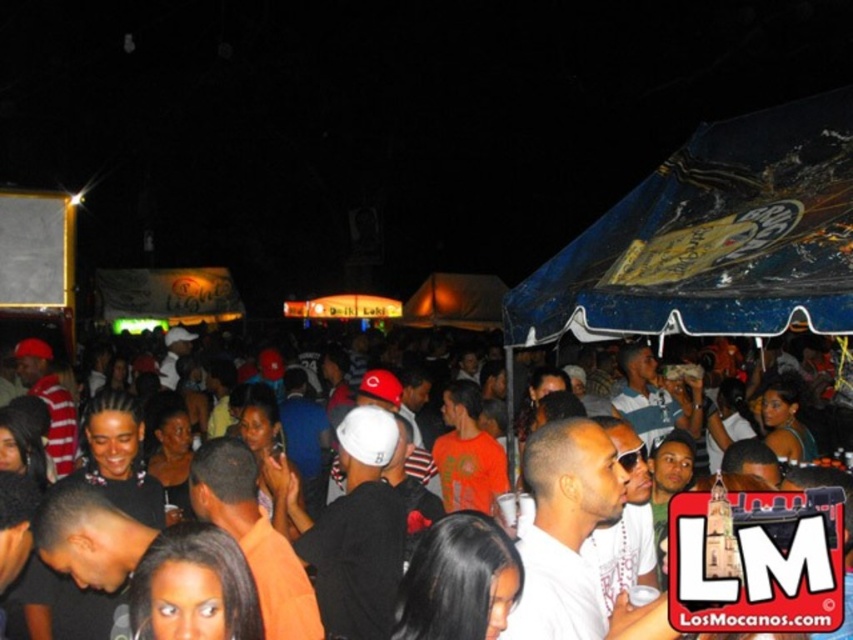
Question: Which point is closer to the camera taking this photo?

Choices:
 (A) (781, 122)
 (B) (38, 630)

Answer: (B)

Question: Which of the following is the closest to the observer?

Choices:
 (A) black matte crowd at center
 (B) blue plastic canopy at upper right

Answer: (A)

Question: Can you confirm if blue plastic canopy at upper right is thinner than black matte crowd at center?

Choices:
 (A) yes
 (B) no

Answer: (A)

Question: Is blue plastic canopy at upper right positioned at the back of black matte crowd at center?

Choices:
 (A) no
 (B) yes

Answer: (B)

Question: Can you confirm if blue plastic canopy at upper right is positioned below black matte crowd at center?

Choices:
 (A) no
 (B) yes

Answer: (A)